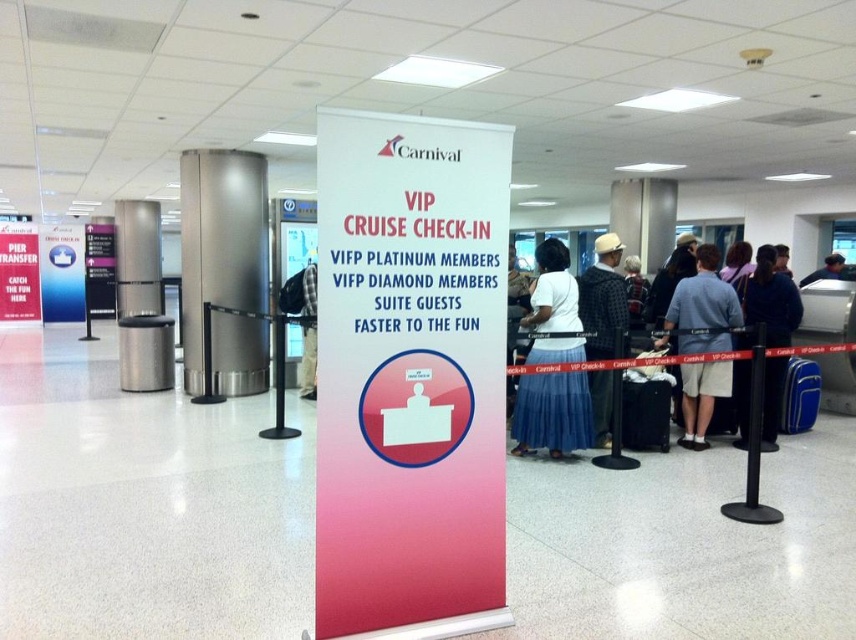
Question: Which point is closer to the camera?

Choices:
 (A) (833, 257)
 (B) (544, 410)
 (C) (325, 435)

Answer: (C)

Question: Is pink paper sign at center in front of black hard suitcase at center?

Choices:
 (A) yes
 (B) no

Answer: (A)

Question: Based on their relative distances, which object is nearer to the black hard suitcase at center?

Choices:
 (A) white matte skirt at center
 (B) white paper sign at center
 (C) plaid fabric shirt at center
 (D) dark blue shirt at center

Answer: (A)

Question: Is blue fabric suitcase at right further to camera compared to dark blue shirt at center?

Choices:
 (A) yes
 (B) no

Answer: (B)

Question: Among these points, which one is farthest from the camera?

Choices:
 (A) (831, 266)
 (B) (740, 403)
 (C) (494, 125)
 (D) (623, 310)

Answer: (A)

Question: Can you confirm if gray cotton shirt at center is wider than white paper sign at center?

Choices:
 (A) no
 (B) yes

Answer: (B)